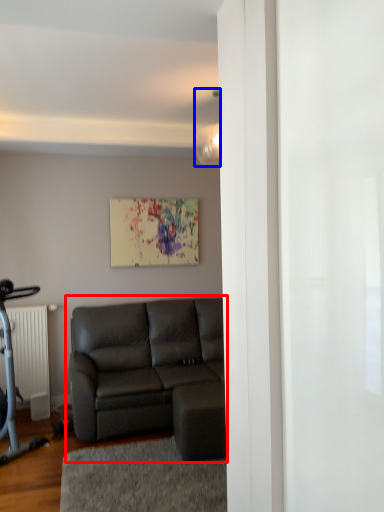
Question: Which object is further to the camera taking this photo, studio couch (highlighted by a red box) or light fixture (highlighted by a blue box)?

Choices:
 (A) studio couch
 (B) light fixture

Answer: (B)